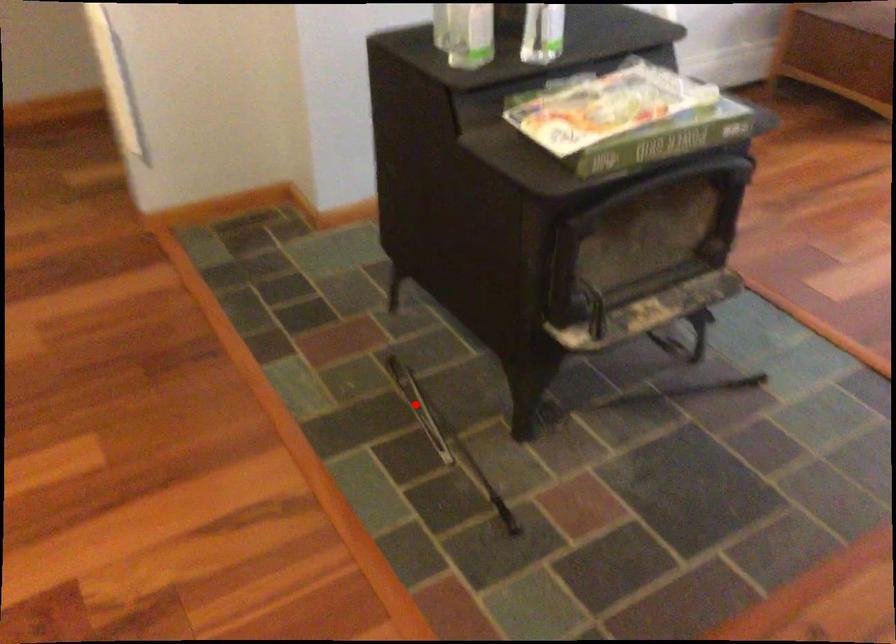
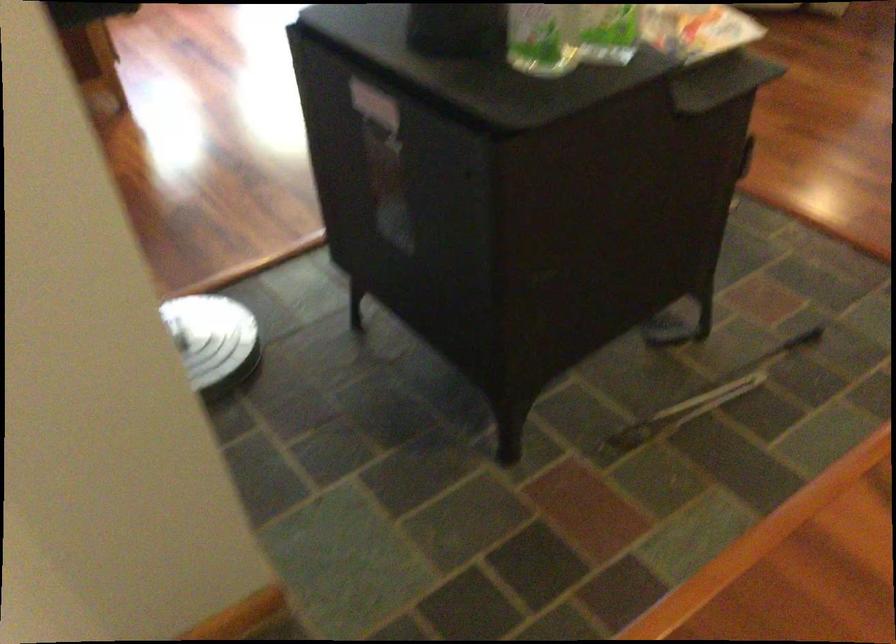
The point at the highlighted location is marked in the first image. Where is the corresponding point in the second image?

(702, 399)